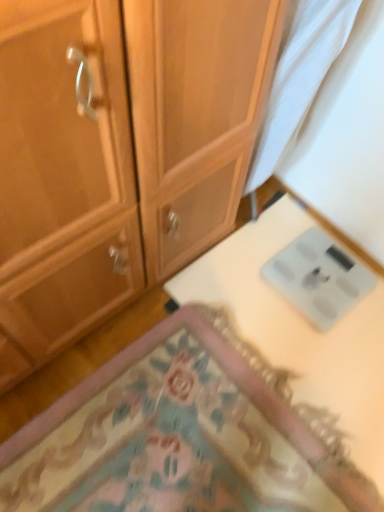
Question: Is carpeted mat at lower center looking in the opposite direction of white glossy scale at lower right?

Choices:
 (A) yes
 (B) no

Answer: (B)

Question: Can you confirm if carpeted mat at lower center is smaller than white glossy scale at lower right?

Choices:
 (A) yes
 (B) no

Answer: (B)

Question: Is carpeted mat at lower center taller than white glossy scale at lower right?

Choices:
 (A) no
 (B) yes

Answer: (B)

Question: Is carpeted mat at lower center bigger than white glossy scale at lower right?

Choices:
 (A) yes
 (B) no

Answer: (A)

Question: Does carpeted mat at lower center have a lesser width compared to white glossy scale at lower right?

Choices:
 (A) no
 (B) yes

Answer: (A)

Question: Does carpeted mat at lower center turn towards white glossy scale at lower right?

Choices:
 (A) yes
 (B) no

Answer: (A)

Question: Considering the relative sizes of white glossy scale at lower right and white sheer curtain at upper right in the image provided, is white glossy scale at lower right thinner than white sheer curtain at upper right?

Choices:
 (A) yes
 (B) no

Answer: (B)

Question: From a real-world perspective, does white glossy scale at lower right sit lower than white sheer curtain at upper right?

Choices:
 (A) no
 (B) yes

Answer: (B)

Question: From the image's perspective, would you say white glossy scale at lower right is shown under white sheer curtain at upper right?

Choices:
 (A) no
 (B) yes

Answer: (B)

Question: Is white glossy scale at lower right positioned behind white sheer curtain at upper right?

Choices:
 (A) no
 (B) yes

Answer: (B)

Question: From the image's perspective, is white glossy scale at lower right over white sheer curtain at upper right?

Choices:
 (A) yes
 (B) no

Answer: (B)

Question: Does white glossy scale at lower right appear on the right side of white sheer curtain at upper right?

Choices:
 (A) yes
 (B) no

Answer: (A)

Question: From the image's perspective, is white glossy scale at lower right located above carpeted mat at lower center?

Choices:
 (A) no
 (B) yes

Answer: (B)